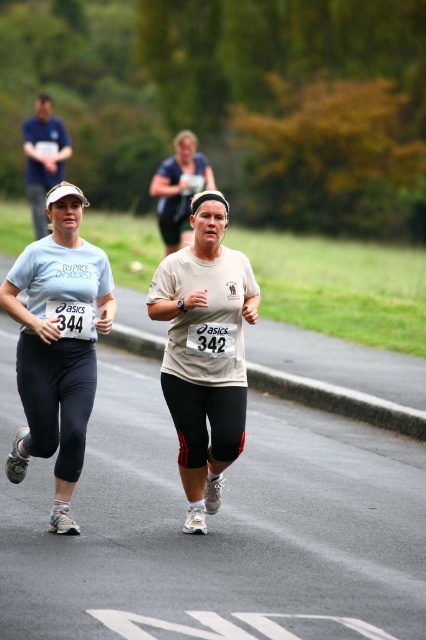
Is white matte running shirt at center to the right of matte white tank top at center from the viewer's perspective?

Yes, white matte running shirt at center is to the right of matte white tank top at center.

Between white matte running shirt at center and matte white tank top at center, which one appears on the right side from the viewer's perspective?

From the viewer's perspective, white matte running shirt at center appears more on the right side.

Where is `white matte running shirt at center`? white matte running shirt at center is located at coordinates (204, 352).

Is matte white tank top at center taller than dark blue shirt at upper left?

No.

Does matte white tank top at center have a lesser height compared to dark blue shirt at upper left?

Yes.

At what (x,y) coordinates should I click in order to perform the action: click on matte white tank top at center. Please return your answer as a coordinate pair (x, y). Looking at the image, I should click on (180, 189).

Locate an element on the screen. matte white tank top at center is located at coordinates (180, 189).

Describe the element at coordinates (57, 344) in the screenshot. I see `white matte t-shirt at center` at that location.

Which is below, white matte t-shirt at center or dark blue shirt at upper left?

white matte t-shirt at center

Where is `white matte t-shirt at center`? white matte t-shirt at center is located at coordinates (57, 344).